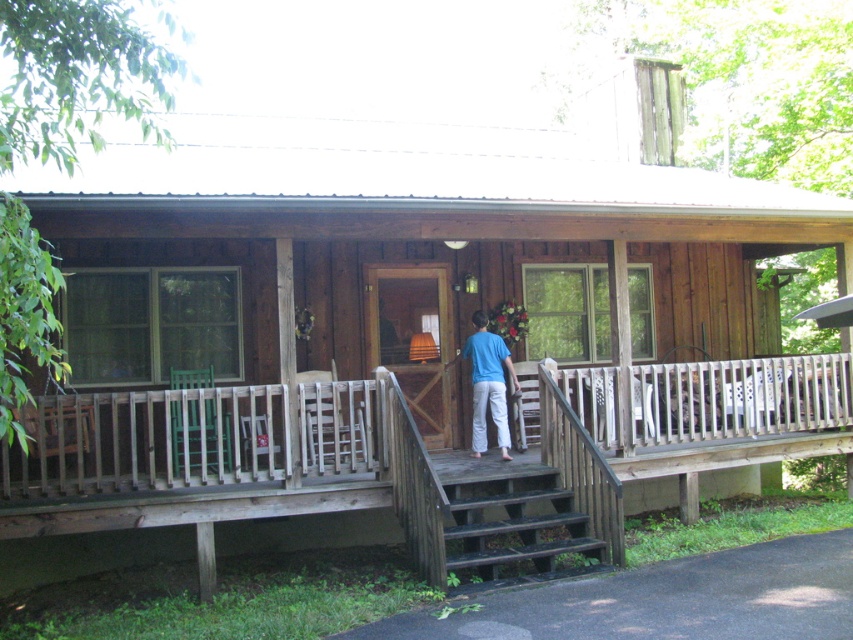
Question: Among these points, which one is farthest from the camera?

Choices:
 (A) (454, 488)
 (B) (474, 458)

Answer: (B)

Question: Is wooden porch at center thinner than blue cotton shirt at center?

Choices:
 (A) no
 (B) yes

Answer: (A)

Question: Considering the relative positions of dark brown wooden stairs at center and blue cotton shirt at center in the image provided, where is dark brown wooden stairs at center located with respect to blue cotton shirt at center?

Choices:
 (A) left
 (B) right

Answer: (A)

Question: Is dark brown wooden stairs at center smaller than blue cotton shirt at center?

Choices:
 (A) yes
 (B) no

Answer: (B)

Question: Estimate the real-world distances between objects in this image. Which object is closer to the dark brown wooden stairs at center?

Choices:
 (A) blue cotton shirt at center
 (B) wooden porch at center

Answer: (A)

Question: Which object is the closest to the wooden porch at center?

Choices:
 (A) blue cotton shirt at center
 (B) dark brown wooden stairs at center

Answer: (B)